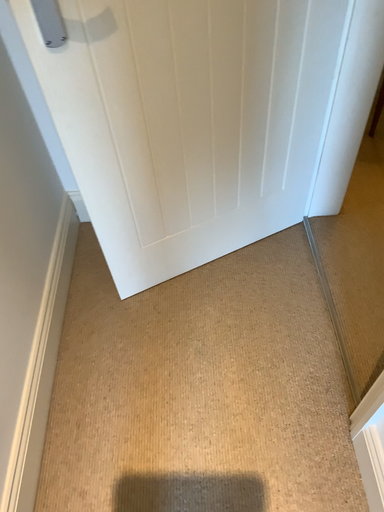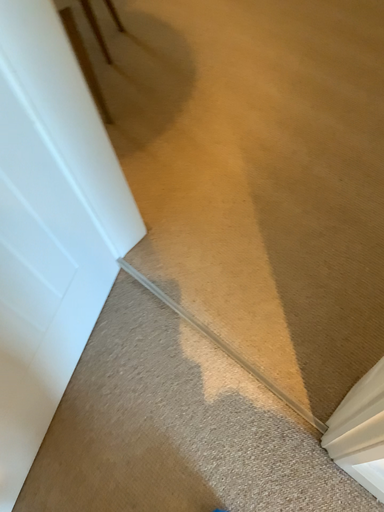
Question: How did the camera likely rotate when shooting the video?

Choices:
 (A) rotated right
 (B) rotated left

Answer: (A)